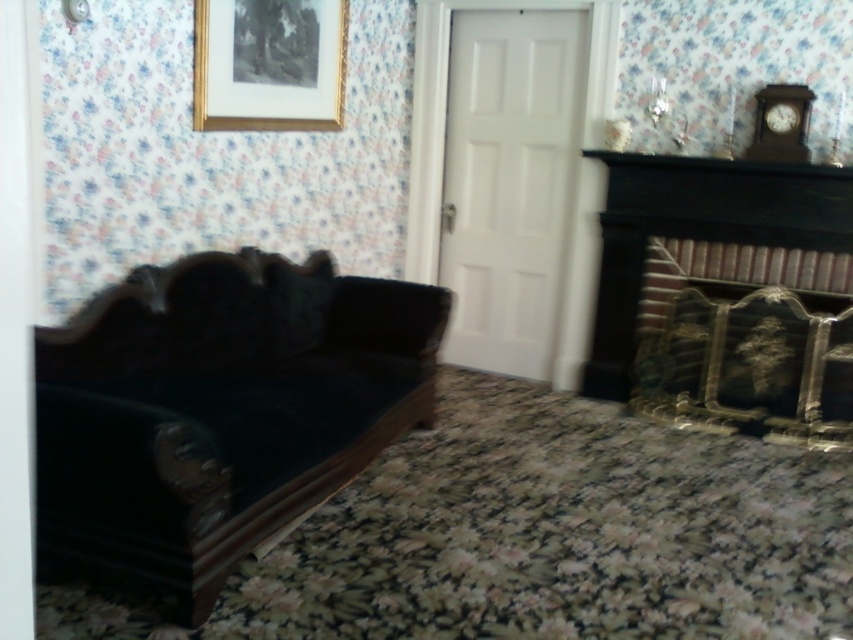
Can you confirm if black brick fireplace at right is positioned to the left of gold-framed print at upper center?

No, black brick fireplace at right is not to the left of gold-framed print at upper center.

Is point (631, 156) closer to camera compared to point (225, 22)?

No, (631, 156) is further to viewer.

Who is more distant from viewer, (735, 163) or (283, 115)?

The point (735, 163) is behind.

Where is `black brick fireplace at right`? The image size is (853, 640). black brick fireplace at right is located at coordinates (726, 296).

Can you confirm if velvet dark brown couch at lower left is positioned below gold-framed print at upper center?

Yes, velvet dark brown couch at lower left is below gold-framed print at upper center.

Which is behind, point (404, 348) or point (221, 88)?

The point (404, 348) is more distant.

This screenshot has height=640, width=853. I want to click on velvet dark brown couch at lower left, so click(x=219, y=406).

Is gold-framed print at upper center positioned at the back of velvety black pillow at center?

That is False.

Does point (257, 54) lie in front of point (277, 348)?

Yes.

Does point (241, 104) come farther from viewer compared to point (315, 339)?

No.

You are a GUI agent. You are given a task and a screenshot of the screen. Output one action in this format:
    pyautogui.click(x=<x>, y=<y>)
    Task: Click on the gold-framed print at upper center
    Image resolution: width=853 pixels, height=640 pixels.
    Given the screenshot: What is the action you would take?
    pyautogui.click(x=270, y=65)